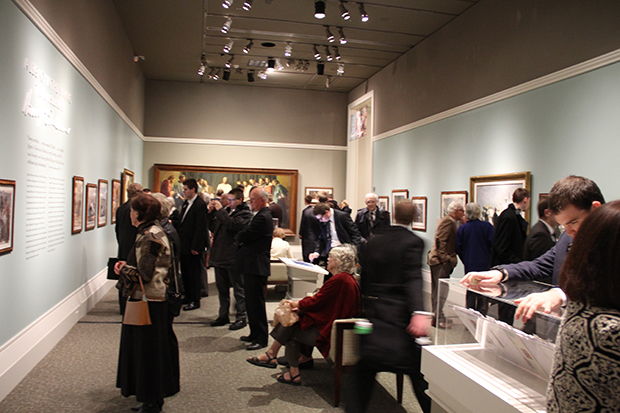
Identify the location of frames pieces on left blue wall. (73, 201), (91, 204), (103, 199), (113, 192), (126, 175).